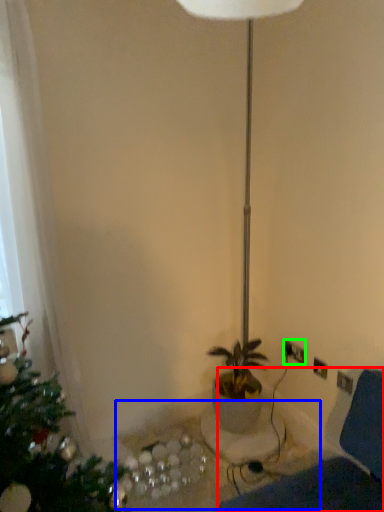
Question: Estimate the real-world distances between objects in this image. Which object is closer to swivel chair (highlighted by a red box), table (highlighted by a blue box) or electric outlet (highlighted by a green box)?

Choices:
 (A) table
 (B) electric outlet

Answer: (A)